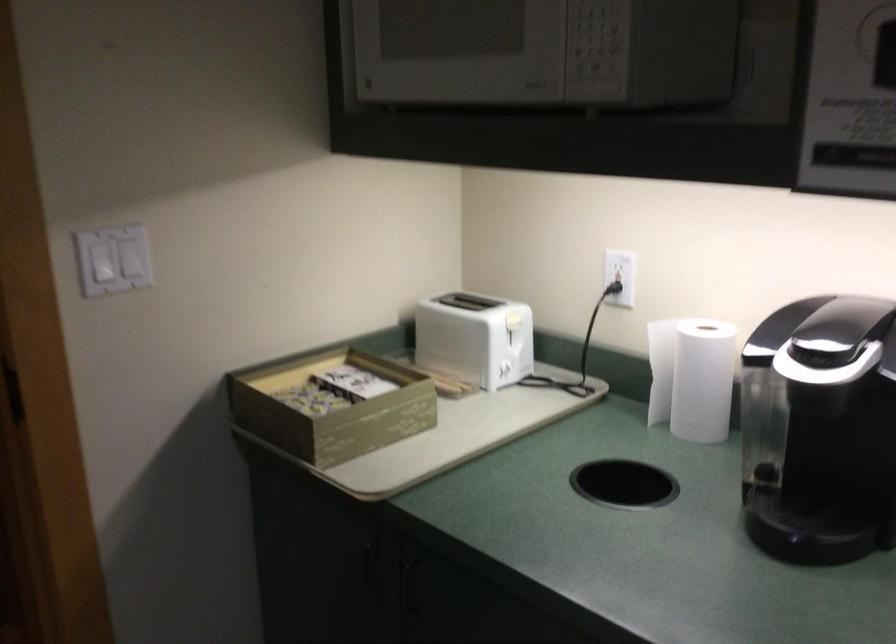
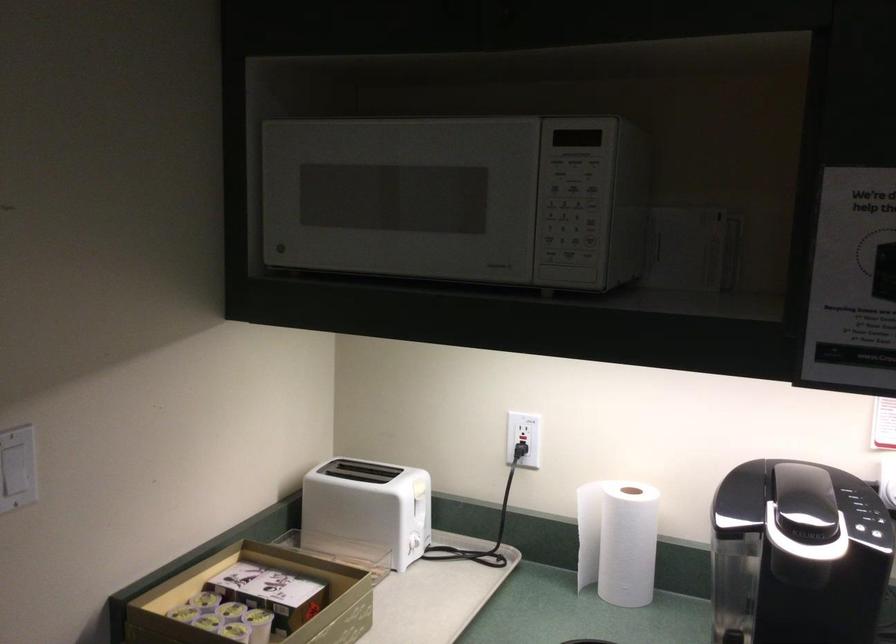
In the second image, find the point that corresponds to [332,406] in the first image.

(259, 625)